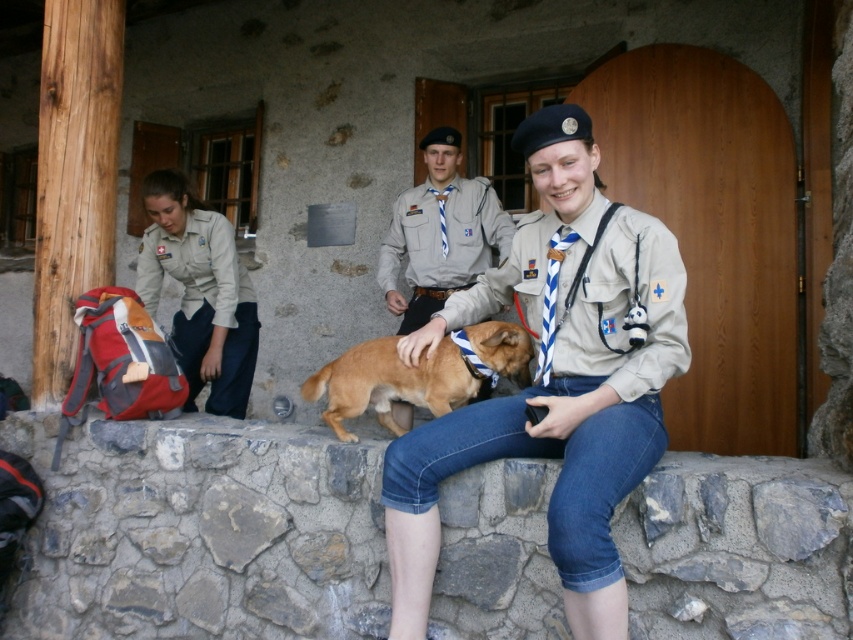
Is point (604, 324) closer to viewer compared to point (430, 316)?

Yes, it is.

Between khaki fabric shirt at center and light brown uniform at center, which one is positioned higher?

Positioned higher is light brown uniform at center.

Is point (560, 362) closer to viewer compared to point (426, 278)?

Yes, it is in front of point (426, 278).

The width and height of the screenshot is (853, 640). Find the location of `khaki fabric shirt at center`. khaki fabric shirt at center is located at coordinates click(567, 380).

What do you see at coordinates (567, 380) in the screenshot? The width and height of the screenshot is (853, 640). I see `khaki fabric shirt at center` at bounding box center [567, 380].

Which is in front, point (556, 221) or point (402, 378)?

Positioned in front is point (556, 221).

Is point (537, 312) more distant than point (369, 348)?

That is False.

Locate an element on the screen. Image resolution: width=853 pixels, height=640 pixels. khaki fabric shirt at center is located at coordinates (567, 380).

Which is behind, point (230, 314) or point (396, 376)?

Positioned behind is point (230, 314).

What do you see at coordinates (204, 305) in the screenshot? I see `matte khaki uniform at left` at bounding box center [204, 305].

Locate an element on the screen. matte khaki uniform at left is located at coordinates (204, 305).